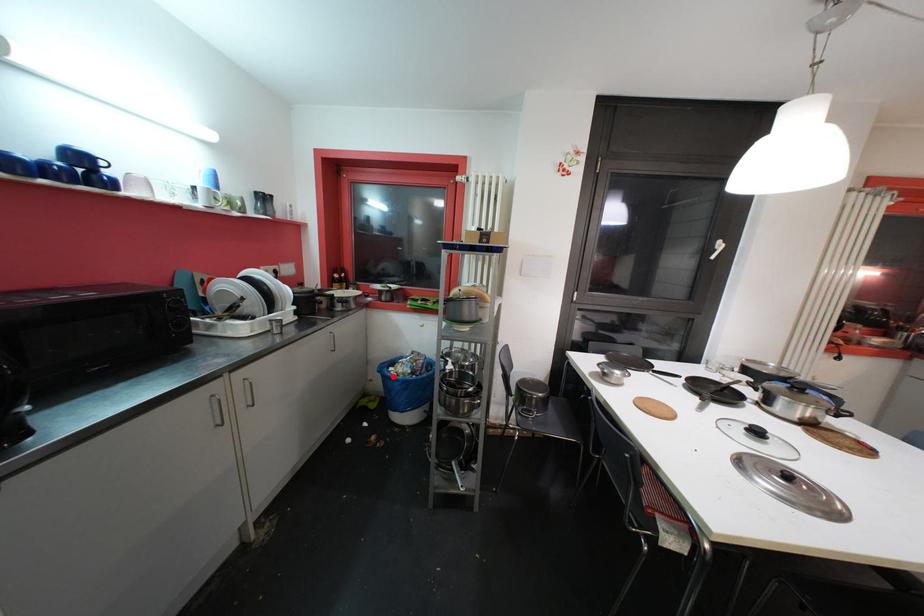
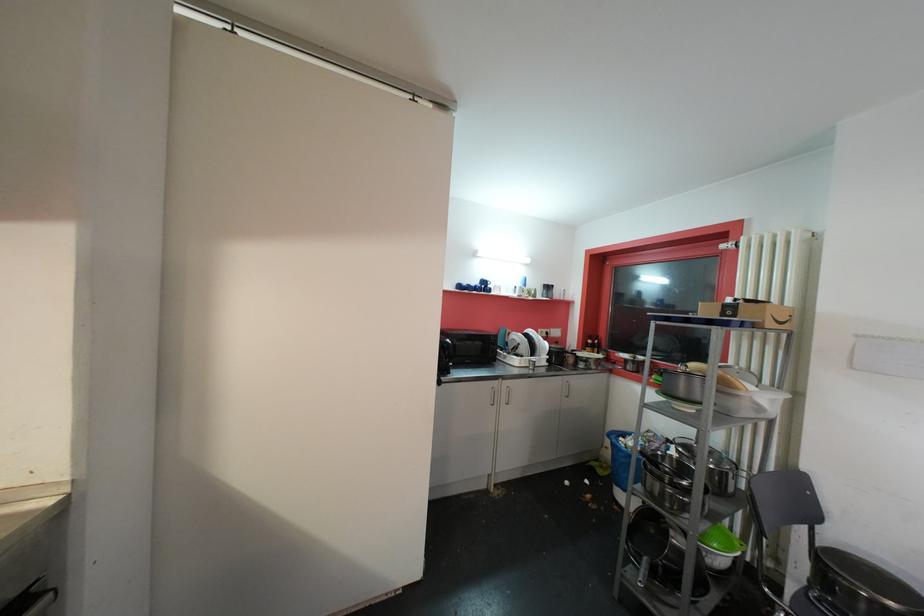
Find the pixel in the second image that matches the highlighted location in the first image.

(619, 443)